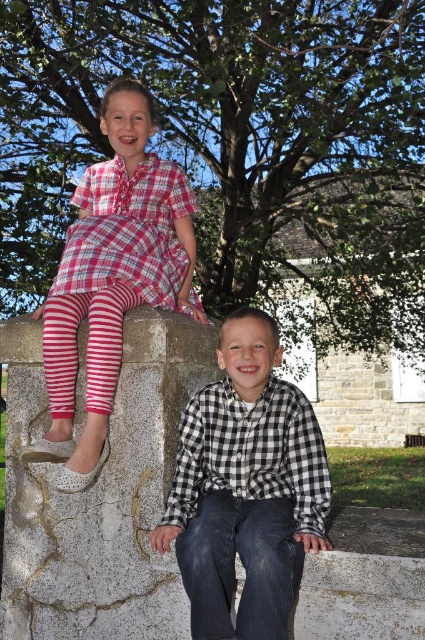
You are standing at the point labeled point (x=108, y=173) and want to throw a ball to a friend who is standing 4 meters away from you. Will the ball reach your friend if you throw it?

The distance between you and your friend is 3.39 meters, so yes, the ball will reach your friend since the distance is less than 4 meters.

You are a drone operator trying to land a drone on the gray concrete at center. The drone has a GPS that shows coordinates. Where should you direct the drone to land?

The gray concrete at center is located at coordinates point (99,492), so direct the drone to land there.